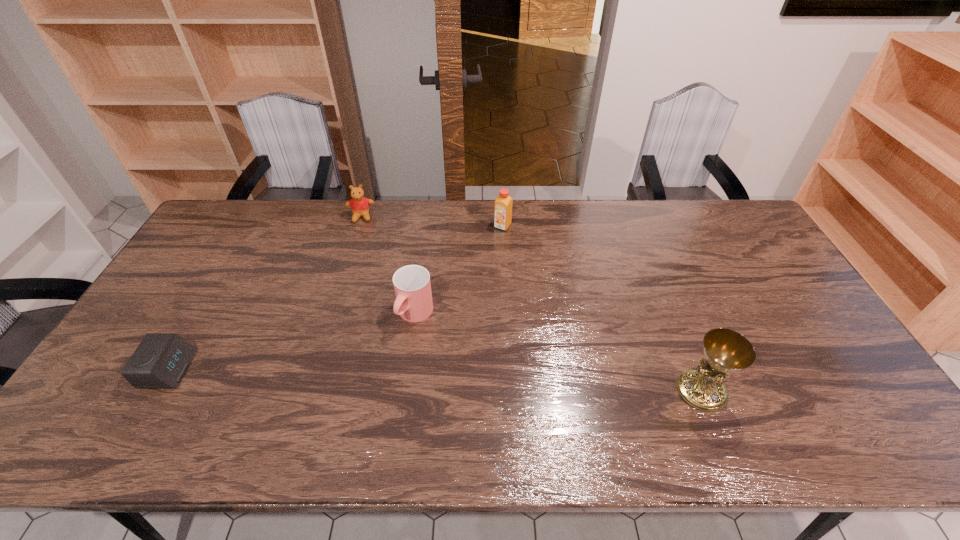
At what (x,y) coordinates should I click in order to perform the action: click on vacant space in between the alarm clock and the teddy bear. Please return your answer as a coordinate pair (x, y). The height and width of the screenshot is (540, 960). Looking at the image, I should click on (265, 293).

The height and width of the screenshot is (540, 960). I want to click on free space that is in between the cup and the fourth object from right to left, so click(388, 266).

Where is `free space between the second object from left to right and the tallest object`? The width and height of the screenshot is (960, 540). free space between the second object from left to right and the tallest object is located at coordinates (531, 303).

The width and height of the screenshot is (960, 540). Find the location of `free area in between the second object from right to left and the second object from left to right`. free area in between the second object from right to left and the second object from left to right is located at coordinates (432, 221).

At what (x,y) coordinates should I click in order to perform the action: click on blank region between the leftmost object and the second object from right to left. Please return your answer as a coordinate pair (x, y). Looking at the image, I should click on (336, 298).

Where is `empty space between the third nearest object and the chalice`? The image size is (960, 540). empty space between the third nearest object and the chalice is located at coordinates (558, 352).

Identify the location of vacant space that is in between the teddy bear and the third farthest object. (388, 266).

Where is `free space between the fourth object from right to left and the tallest object`? This screenshot has height=540, width=960. free space between the fourth object from right to left and the tallest object is located at coordinates (531, 303).

Point out which object is positioned as the third nearest to the fourth object from left to right. Please provide its 2D coordinates. Your answer should be formatted as a tuple, i.e. [(x, y)], where the tuple contains the x and y coordinates of a point satisfying the conditions above.

[(726, 351)]

Identify which object is located as the third nearest to the second object from left to right. Please provide its 2D coordinates. Your answer should be formatted as a tuple, i.e. [(x, y)], where the tuple contains the x and y coordinates of a point satisfying the conditions above.

[(160, 361)]